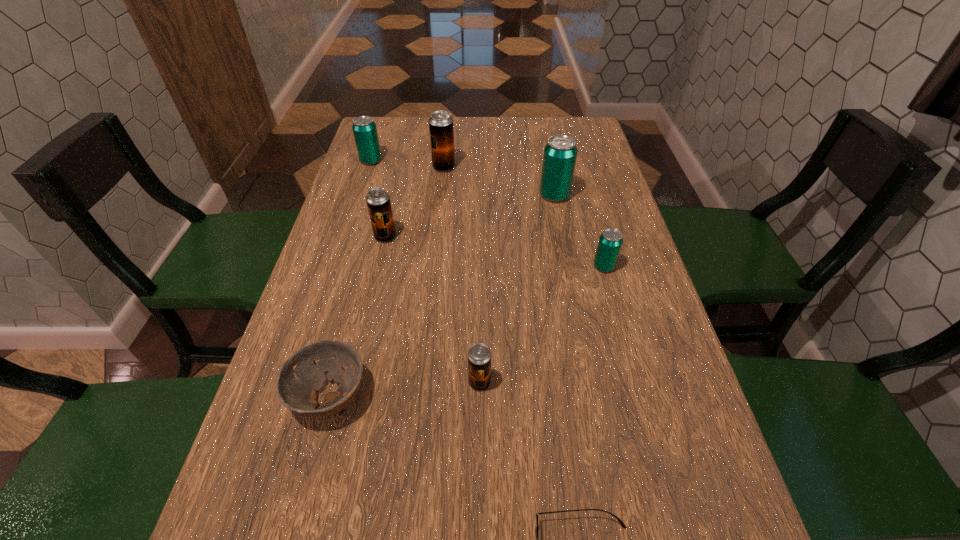
Where is `the third beer can from left to right`? the third beer can from left to right is located at coordinates (441, 130).

Identify the location of the second black beer can from right to left. (441, 130).

Identify the location of the second teal beer can from right to left. The image size is (960, 540). (560, 153).

At what (x,y) coordinates should I click in order to perform the action: click on the sixth nearest object. Please return your answer as a coordinate pair (x, y). Looking at the image, I should click on (560, 153).

Image resolution: width=960 pixels, height=540 pixels. What are the coordinates of `the second farthest black beer can` in the screenshot? It's located at (378, 201).

The width and height of the screenshot is (960, 540). I want to click on the fourth farthest object, so click(x=378, y=201).

You are a GUI agent. You are given a task and a screenshot of the screen. Output one action in this format:
    pyautogui.click(x=<x>, y=<y>)
    Task: Click on the leftmost teal beer can
    
    Given the screenshot: What is the action you would take?
    pyautogui.click(x=364, y=128)

This screenshot has height=540, width=960. What are the coordinates of `the second biggest teal beer can` in the screenshot? It's located at (364, 128).

Where is `the fifth farthest object`? the fifth farthest object is located at coordinates (610, 242).

You are a GUI agent. You are given a task and a screenshot of the screen. Output one action in this format:
    pyautogui.click(x=<x>, y=<y>)
    Task: Click on the fifth farthest beer can
    
    Given the screenshot: What is the action you would take?
    pyautogui.click(x=610, y=242)